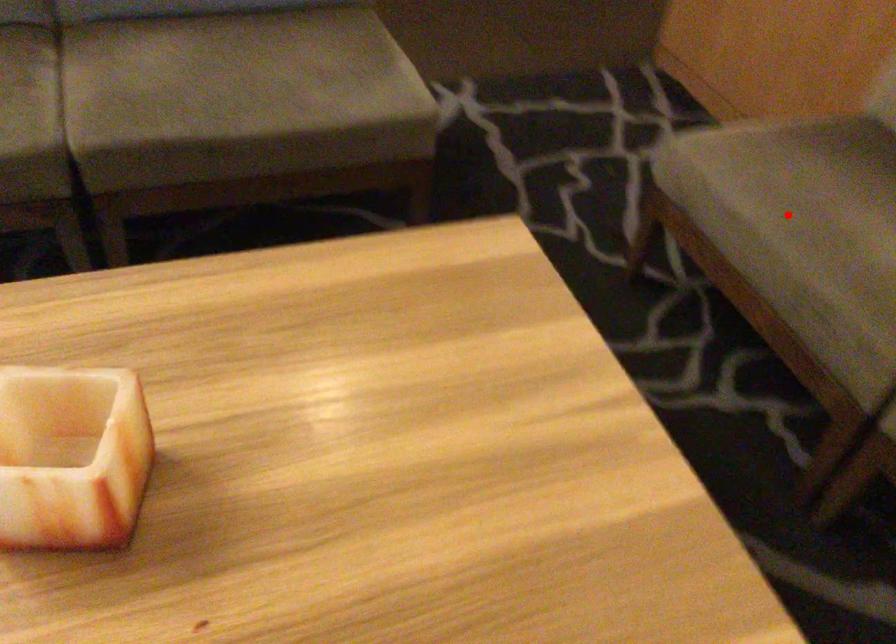
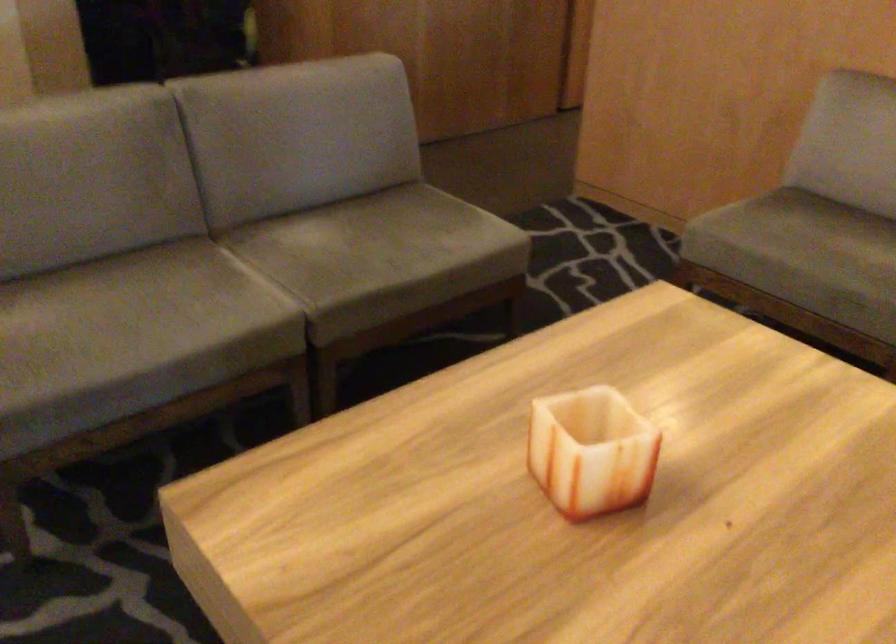
Question: I am providing you with two images of the same scene from different viewpoints. In image1, a red point is highlighted. Considering the same 3D point in image2, which of the following is correct?

Choices:
 (A) It is closer
 (B) It is farther

Answer: (B)